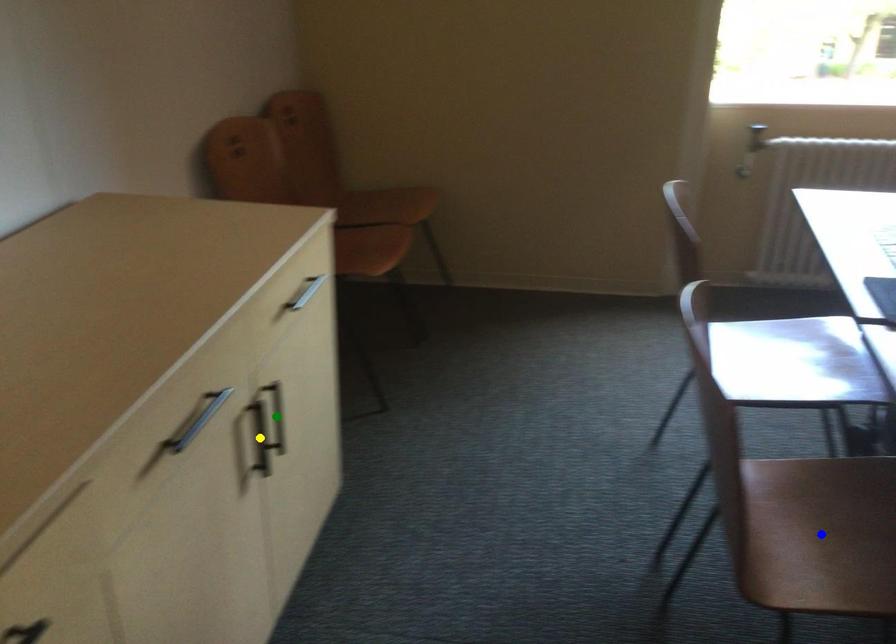
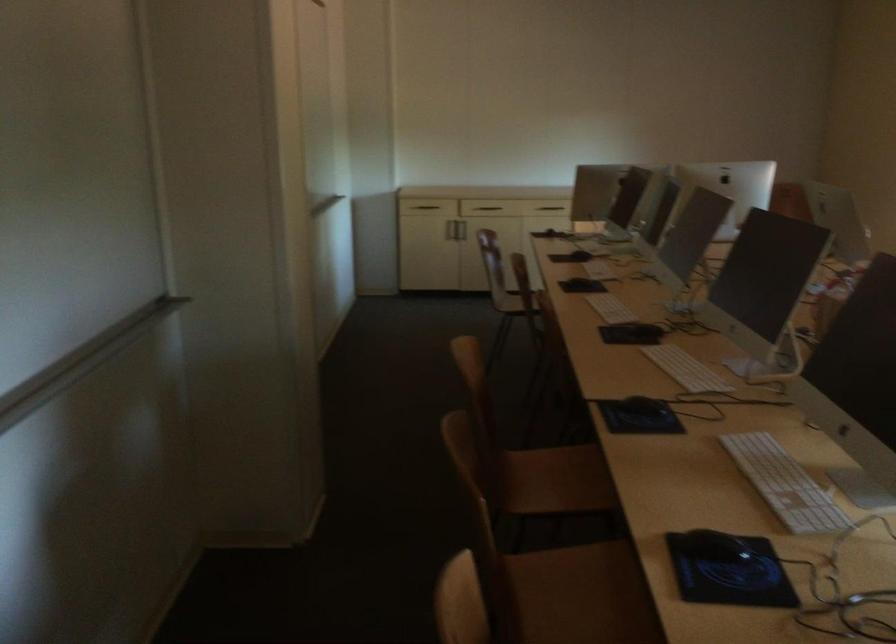
I am providing you with two images of the same scene from different viewpoints. Three points are marked in image1. Which point corresponds to a part or object that is occluded in image2?In image1, three points are marked. Which of them correspond to a part or object that is occluded in image2?Among the three points shown in image1, which one corresponds to a part or object that is no longer visible due to occlusion in image2?

Invisible in image2: green point, blue point, yellow point.